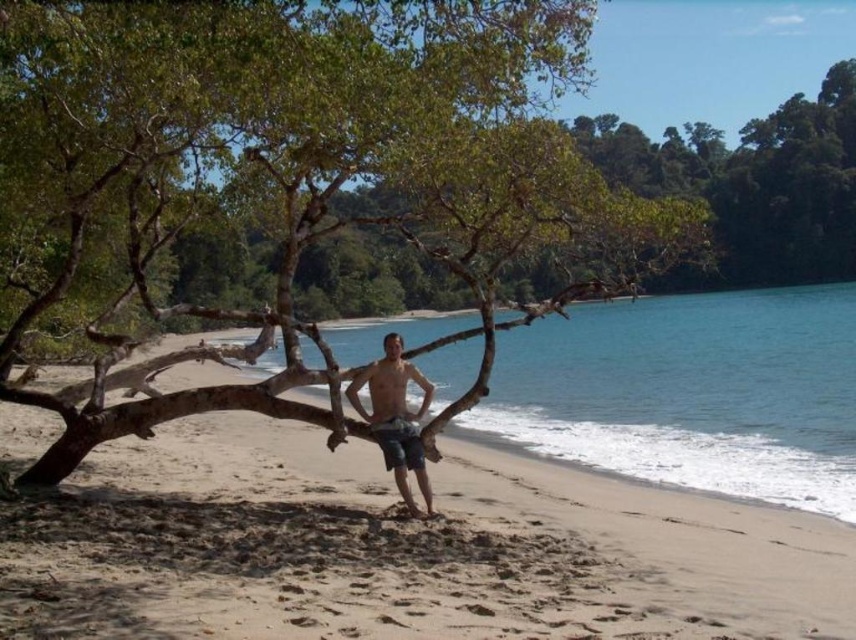
Question: Can you confirm if sandy beach at center is positioned to the right of blue clear water at center?

Choices:
 (A) no
 (B) yes

Answer: (A)

Question: Based on their relative distances, which object is farther from the denim shorts at center?

Choices:
 (A) sandy beach at center
 (B) blue clear water at center

Answer: (B)

Question: Can you confirm if sandy beach at center is smaller than denim shorts at center?

Choices:
 (A) no
 (B) yes

Answer: (A)

Question: Among these objects, which one is nearest to the camera?

Choices:
 (A) denim shorts at center
 (B) sandy beach at center
 (C) blue clear water at center

Answer: (B)

Question: Does sandy beach at center have a larger size compared to denim shorts at center?

Choices:
 (A) no
 (B) yes

Answer: (B)

Question: Which object appears closest to the camera in this image?

Choices:
 (A) sandy beach at center
 (B) denim shorts at center
 (C) blue clear water at center

Answer: (A)